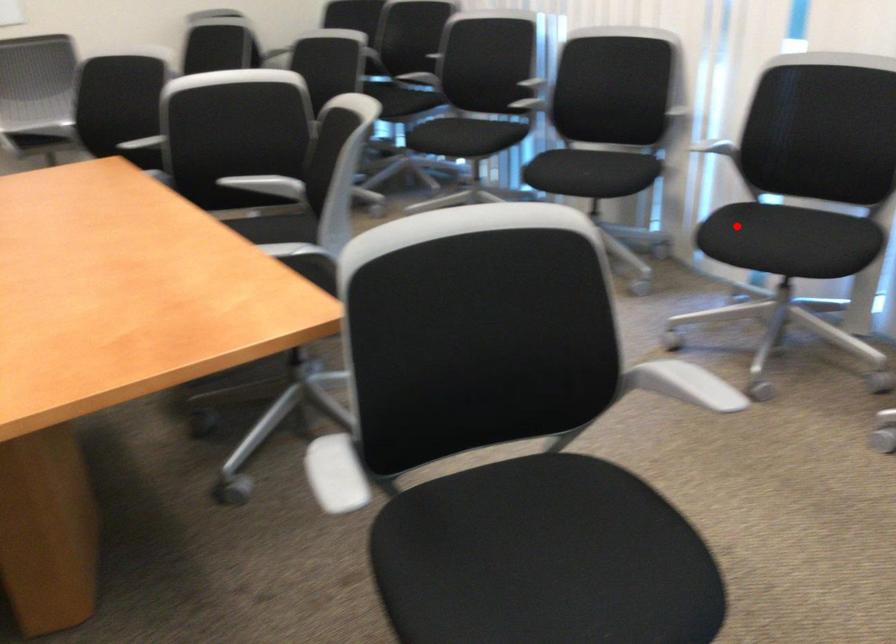
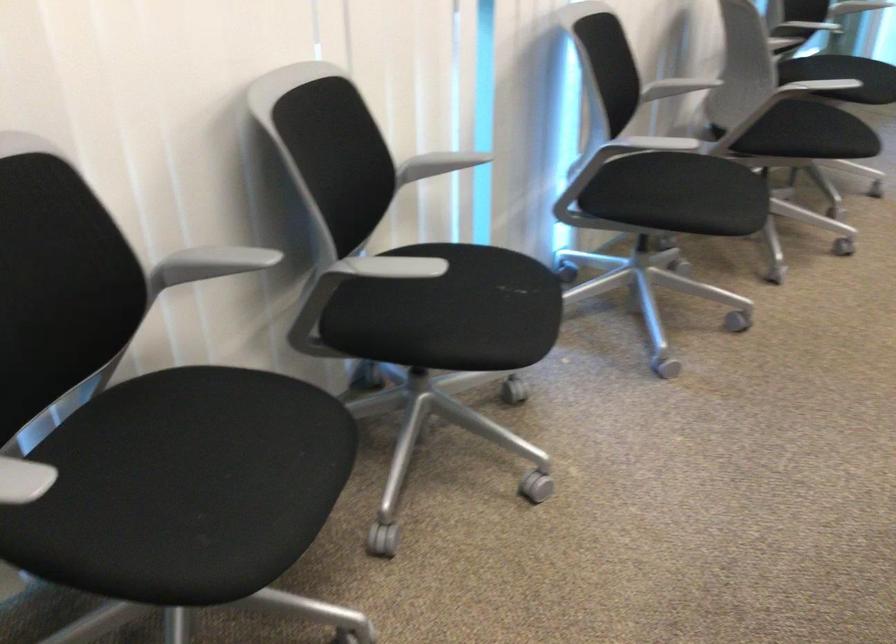
In the second image, find the point that corresponds to the highlighted location in the first image.

(679, 194)